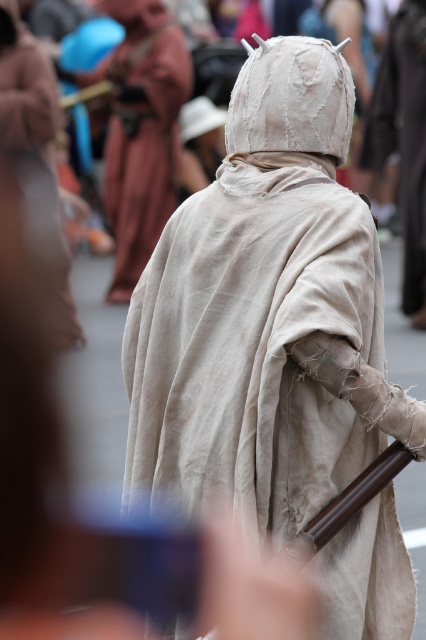
Can you confirm if beige fabric monk at center is wider than light beige fabric monk at center?

Yes.

Who is shorter, beige fabric monk at center or light beige fabric monk at center?

Standing shorter between the two is beige fabric monk at center.

Identify the location of beige fabric monk at center. The image size is (426, 640). (265, 314).